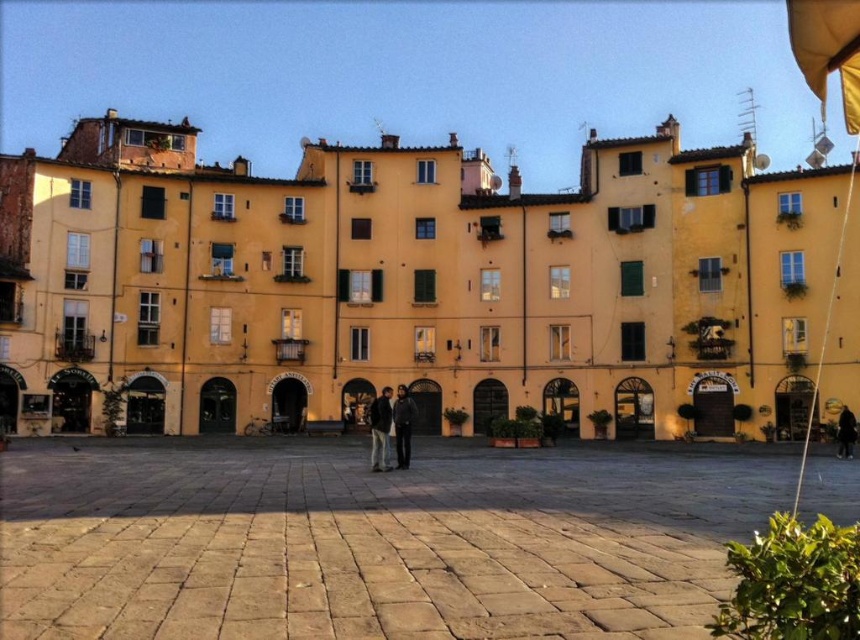
Based on the photo, you are standing in the European square and want to take a photo of the point at coordinate (679, 248). Your camera can focus on objects within 75 meters. Will the point be in focus?

The point at coordinate (679, 248) is 74.89 meters away from the viewer, which is within the camera focus range of 75 meters. Therefore, the point will be in focus.